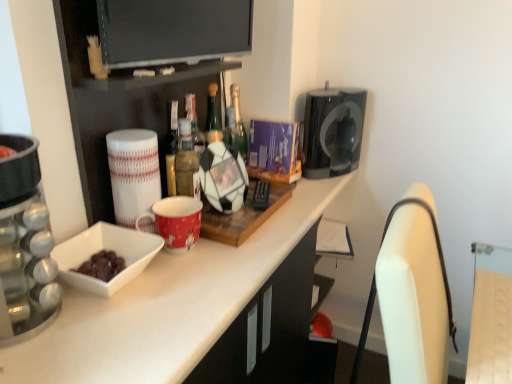
Question: Is black glossy coffee machine at upper right, the 2th appliance viewed from the left, bigger or smaller than white ceramic mug at left, which appears as the 1th appliance when viewed from the left?

Choices:
 (A) small
 (B) big

Answer: (B)

Question: From their relative heights in the image, would you say black glossy coffee machine at upper right, arranged as the second appliance when viewed from the front, is taller or shorter than white ceramic mug at left, the second appliance when ordered from right to left?

Choices:
 (A) short
 (B) tall

Answer: (B)

Question: Considering the real-world distances, which object is closest to the white glossy bowl at left?

Choices:
 (A) red glossy mug at center
 (B) white glossy countertop at center
 (C) light brown wood swivel chair at right, marked as the 1th swivel chair in a top-to-bottom arrangement
 (D) white glossy mug at upper center
 (E) white ceramic mug at left, which appears as the 1th appliance when viewed from the left

Answer: (B)

Question: Which of these objects is positioned farthest from the white leather swivel chair at right, the second swivel chair from the top?

Choices:
 (A) white glossy bowl at left
 (B) green glass bottle at center
 (C) light brown wood swivel chair at right, arranged as the second swivel chair when ordered from the bottom
 (D) white glossy countertop at center
 (E) flat screen tv at upper center

Answer: (B)